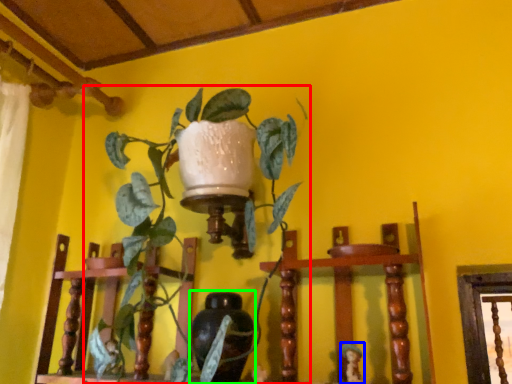
Question: Estimate the real-world distances between objects in this image. Which object is farther from houseplant (highlighted by a red box), toy (highlighted by a blue box) or vase (highlighted by a green box)?

Choices:
 (A) toy
 (B) vase

Answer: (A)